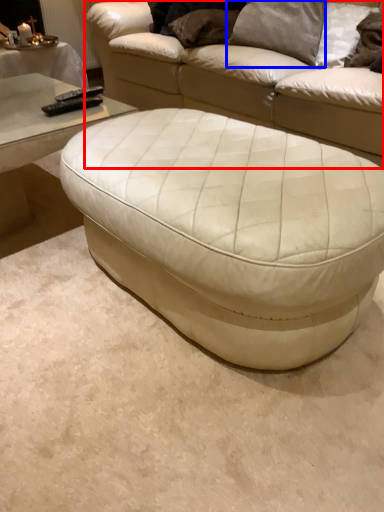
Question: Which object is further to the camera taking this photo, studio couch (highlighted by a red box) or pillow (highlighted by a blue box)?

Choices:
 (A) studio couch
 (B) pillow

Answer: (B)